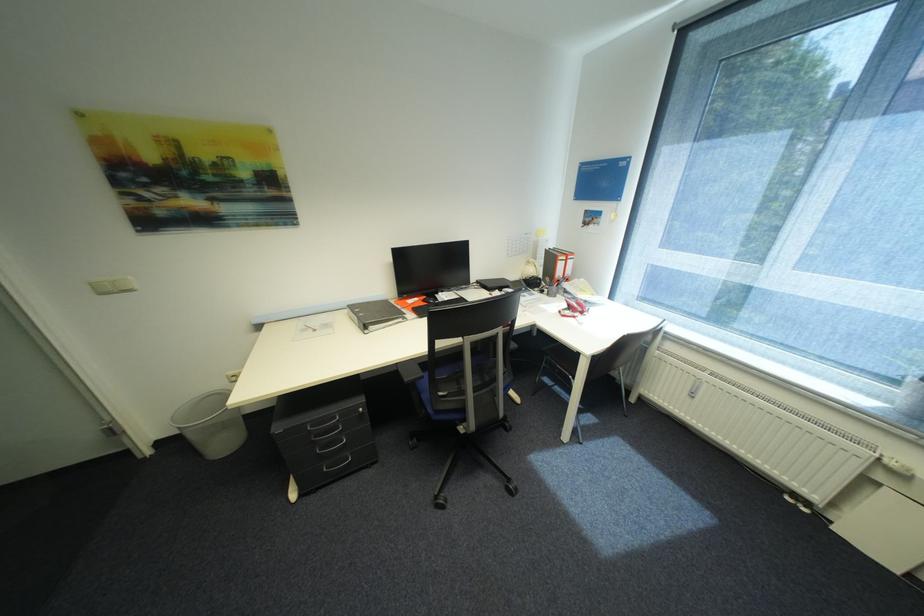
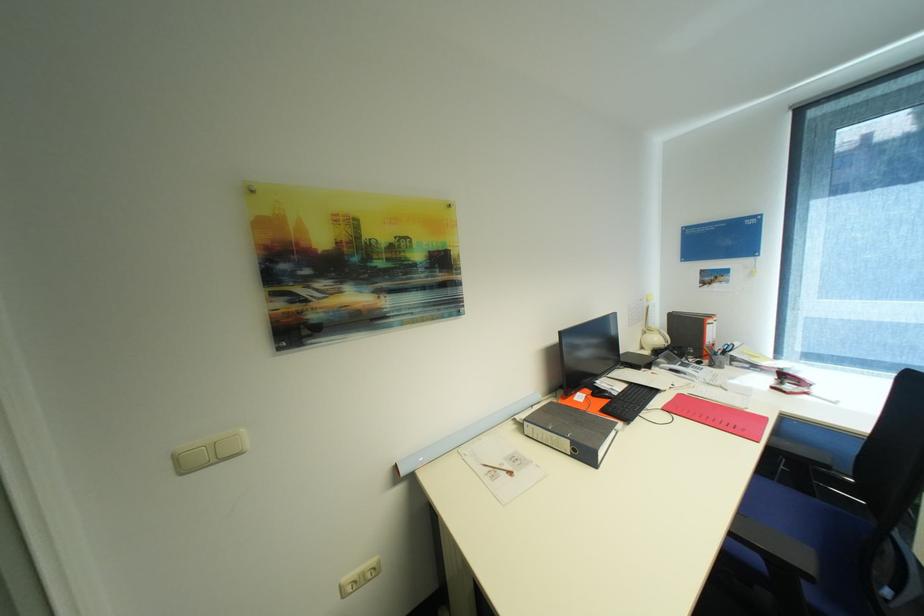
In the second image, find the point that corresponds to point 101,286 in the first image.

(185, 458)